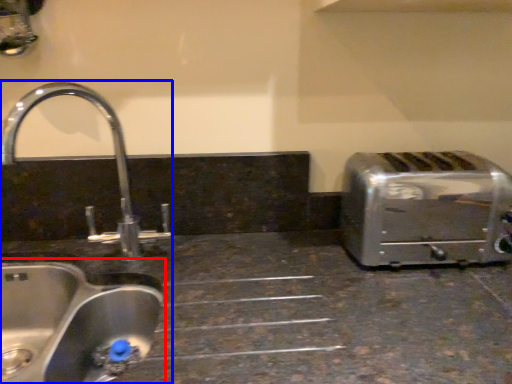
Question: Which of the following is the farthest to the observer, sink (highlighted by a red box) or sink (highlighted by a blue box)?

Choices:
 (A) sink
 (B) sink

Answer: (B)